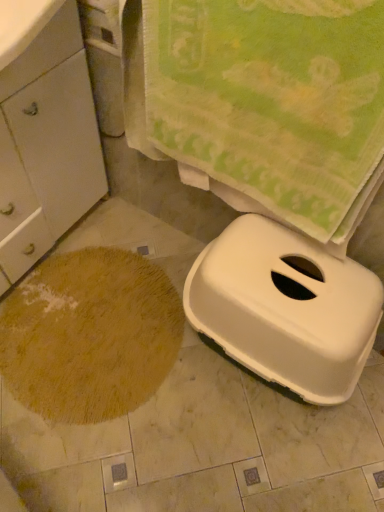
What are the coordinates of `vacant area on top of brown shaggy rug at lower left (from a real-world perspective)` in the screenshot? It's located at (82, 323).